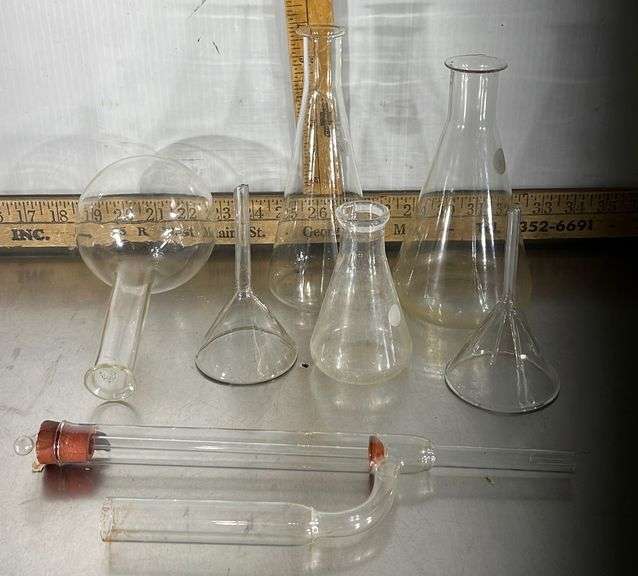
The image size is (638, 576). I want to click on flask, so click(x=503, y=376).